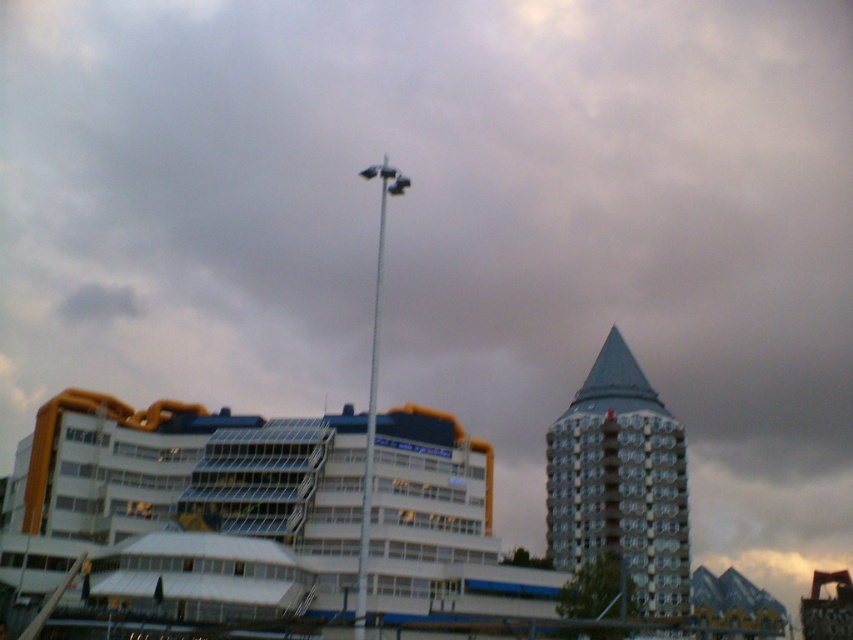
Question: Among these points, which one is farthest from the camera?

Choices:
 (A) (408, 180)
 (B) (403, 497)

Answer: (B)

Question: Among these objects, which one is nearest to the camera?

Choices:
 (A) white glossy building at center
 (B) blue glass tower at upper center

Answer: (A)

Question: Among these objects, which one is farthest from the camera?

Choices:
 (A) blue glass tower at upper center
 (B) white glossy building at center
 (C) white metallic pole at center

Answer: (A)

Question: Does blue glass tower at upper center appear over white metallic pole at center?

Choices:
 (A) yes
 (B) no

Answer: (B)

Question: Does blue glass tower at upper center lie in front of white metallic pole at center?

Choices:
 (A) yes
 (B) no

Answer: (B)

Question: Can you confirm if white glossy building at center is positioned below white metallic pole at center?

Choices:
 (A) yes
 (B) no

Answer: (A)